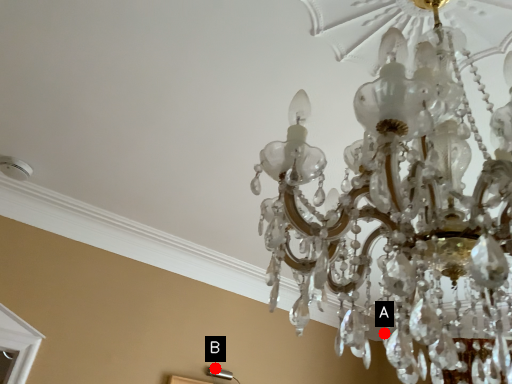
Question: Two points are circled on the image, labeled by A and B beside each circle. Which point is farther to the camera?

Choices:
 (A) A is further
 (B) B is further

Answer: (B)